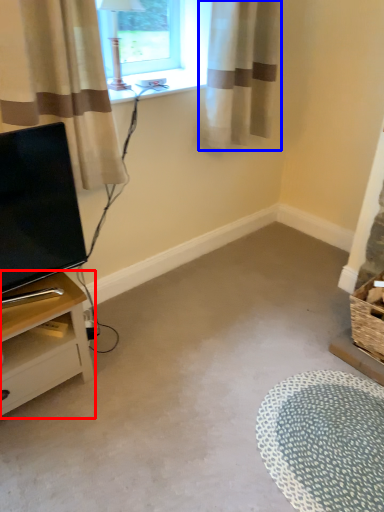
Question: Which object is further to the camera taking this photo, nightstand (highlighted by a red box) or curtain (highlighted by a blue box)?

Choices:
 (A) nightstand
 (B) curtain

Answer: (B)